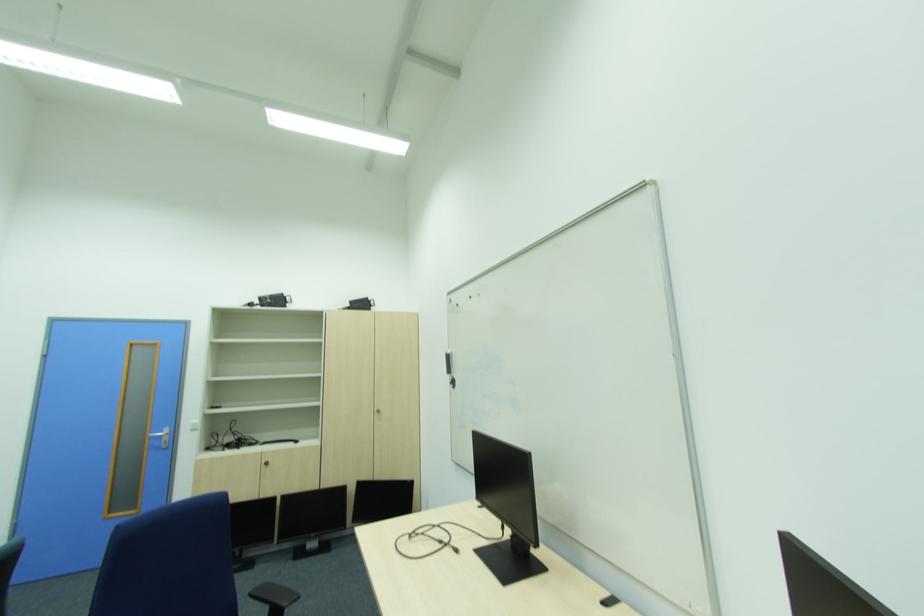
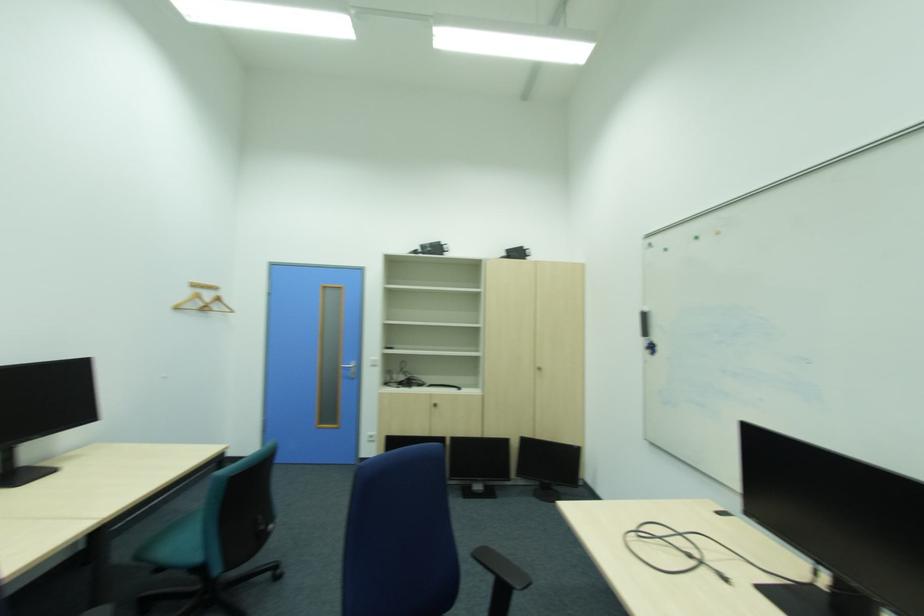
Which direction would the cameraman need to move to produce the second image?

The movement direction of the cameraman is left, forward.